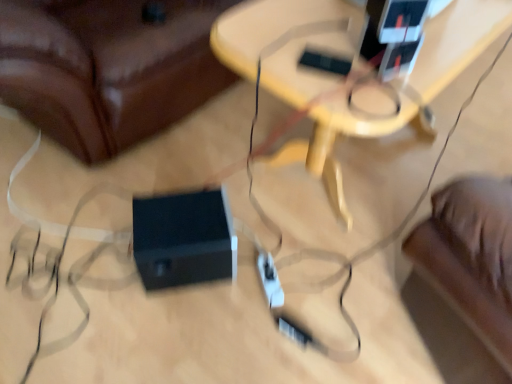
The height and width of the screenshot is (384, 512). What are the coordinates of `vacant point above black plastic speaker at lower center (from a real-world perspective)` in the screenshot? It's located at (187, 218).